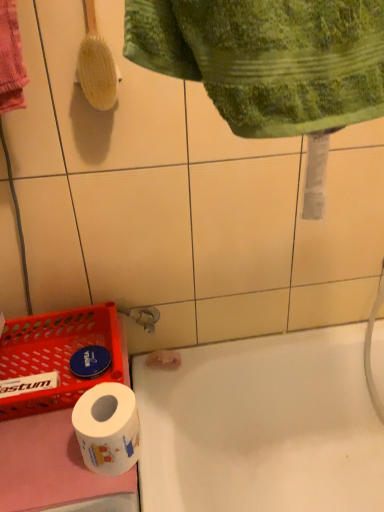
What do you see at coordinates (96, 65) in the screenshot? The width and height of the screenshot is (384, 512). I see `yellow wooden brush at upper left` at bounding box center [96, 65].

Identify the location of yellow wooden brush at upper left. Image resolution: width=384 pixels, height=512 pixels. (96, 65).

Does yellow wooden brush at upper left have a greater height compared to green textured towel at upper center?

Indeed, yellow wooden brush at upper left has a greater height compared to green textured towel at upper center.

Considering the positions of objects yellow wooden brush at upper left and green textured towel at upper center in the image provided, who is more to the right, yellow wooden brush at upper left or green textured towel at upper center?

From the viewer's perspective, green textured towel at upper center appears more on the right side.

Based on the photo, is yellow wooden brush at upper left positioned in front of green textured towel at upper center?

That is False.

Would you say yellow wooden brush at upper left is a long distance from green textured towel at upper center?

No, yellow wooden brush at upper left is in close proximity to green textured towel at upper center.

Considering the sizes of objects green textured towel at upper center and white glossy toilet paper at lower left in the image provided, who is smaller, green textured towel at upper center or white glossy toilet paper at lower left?

With smaller size is white glossy toilet paper at lower left.

Can you tell me how much green textured towel at upper center and white glossy toilet paper at lower left differ in facing direction?

The angle between the facing direction of green textured towel at upper center and the facing direction of white glossy toilet paper at lower left is 0.00291 degrees.

Is green textured towel at upper center closer to the viewer compared to white glossy toilet paper at lower left?

That is True.

Between point (279, 85) and point (84, 433), which one is positioned behind?

Point (84, 433)

Is yellow wooden brush at upper left completely or partially inside green textured towel at upper center?

No.

From a real-world perspective, is green textured towel at upper center physically below yellow wooden brush at upper left?

No, from a real-world perspective, green textured towel at upper center is not under yellow wooden brush at upper left.

Where is `brush that appears on the left of green textured towel at upper center`? The image size is (384, 512). brush that appears on the left of green textured towel at upper center is located at coordinates (x=96, y=65).

Looking at their sizes, would you say green textured towel at upper center is wider or thinner than yellow wooden brush at upper left?

Considering their sizes, green textured towel at upper center looks broader than yellow wooden brush at upper left.

From a real-world perspective, is white glossy bathtub at lower center physically below white glossy toilet paper at lower left?

Yes, from a real-world perspective, white glossy bathtub at lower center is beneath white glossy toilet paper at lower left.

Who is shorter, white glossy bathtub at lower center or white glossy toilet paper at lower left?

white glossy toilet paper at lower left is shorter.

Looking at this image, what's the angular difference between white glossy bathtub at lower center and white glossy toilet paper at lower left's facing directions?

They differ by 0.000882 degrees in their facing directions.

Is white glossy bathtub at lower center outside of white glossy toilet paper at lower left?

Yes, white glossy bathtub at lower center is located beyond the bounds of white glossy toilet paper at lower left.

From the image's perspective, who appears lower, white glossy bathtub at lower center or yellow wooden brush at upper left?

white glossy bathtub at lower center, from the image's perspective.

Who is more distant, white glossy bathtub at lower center or yellow wooden brush at upper left?

white glossy bathtub at lower center is further away from the camera.

Between white glossy bathtub at lower center and yellow wooden brush at upper left, which one appears on the left side from the viewer's perspective?

yellow wooden brush at upper left.

Measure the distance between white glossy toilet paper at lower left and green textured towel at upper center.

The distance of white glossy toilet paper at lower left from green textured towel at upper center is 19.99 inches.

From a real-world perspective, is white glossy toilet paper at lower left on top of green textured towel at upper center?

No.

Is white glossy toilet paper at lower left in contact with green textured towel at upper center?

No, white glossy toilet paper at lower left is not next to green textured towel at upper center.

Does white glossy toilet paper at lower left contain green textured towel at upper center?

Actually, green textured towel at upper center is outside white glossy toilet paper at lower left.

Is white glossy bathtub at lower center to the right of green textured towel at upper center from the viewer's perspective?

Correct, you'll find white glossy bathtub at lower center to the right of green textured towel at upper center.

You are a GUI agent. You are given a task and a screenshot of the screen. Output one action in this format:
    pyautogui.click(x=<x>, y=<y>)
    Task: Click on the bath on the right of green textured towel at upper center
    This screenshot has height=512, width=384.
    Given the screenshot: What is the action you would take?
    (x=262, y=426)

Considering the relative sizes of white glossy bathtub at lower center and green textured towel at upper center in the image provided, is white glossy bathtub at lower center bigger than green textured towel at upper center?

Yes.

Could you tell me if white glossy bathtub at lower center is turned towards green textured towel at upper center?

No.

Where is `towel that is below the yellow wooden brush at upper left (from the image's perspective)`? towel that is below the yellow wooden brush at upper left (from the image's perspective) is located at coordinates (268, 58).

What are the coordinates of `towel lying on the right of white glossy toilet paper at lower left` in the screenshot? It's located at (268, 58).

Based on their spatial positions, is green textured towel at upper center or white glossy bathtub at lower center further from yellow wooden brush at upper left?

Among the two, white glossy bathtub at lower center is located further to yellow wooden brush at upper left.

In the scene shown: Based on their spatial positions, is yellow wooden brush at upper left or white glossy toilet paper at lower left further from green textured towel at upper center?

white glossy toilet paper at lower left is positioned further to the anchor green textured towel at upper center.

Considering their positions, is white glossy toilet paper at lower left positioned further to green textured towel at upper center than yellow wooden brush at upper left?

white glossy toilet paper at lower left is further to green textured towel at upper center.

From the image, which object appears to be farther from white glossy toilet paper at lower left, yellow wooden brush at upper left or green textured towel at upper center?

Based on the image, yellow wooden brush at upper left appears to be further to white glossy toilet paper at lower left.

Based on the photo, from the image, which object appears to be nearer to white glossy toilet paper at lower left, green textured towel at upper center or yellow wooden brush at upper left?

Based on the image, green textured towel at upper center appears to be nearer to white glossy toilet paper at lower left.

Which object lies nearer to the anchor point white glossy toilet paper at lower left, green textured towel at upper center or white glossy bathtub at lower center?

Based on the image, white glossy bathtub at lower center appears to be nearer to white glossy toilet paper at lower left.

When comparing their distances from yellow wooden brush at upper left, does white glossy bathtub at lower center or green textured towel at upper center seem further?

Among the two, white glossy bathtub at lower center is located further to yellow wooden brush at upper left.

Based on their spatial positions, is white glossy bathtub at lower center or yellow wooden brush at upper left closer to white glossy toilet paper at lower left?

white glossy bathtub at lower center.

Where is `toilet paper between green textured towel at upper center and white glossy bathtub at lower center in the vertical direction`? toilet paper between green textured towel at upper center and white glossy bathtub at lower center in the vertical direction is located at coordinates (107, 428).

Identify the location of towel between yellow wooden brush at upper left and white glossy toilet paper at lower left from top to bottom. (268, 58).

Identify the location of towel between yellow wooden brush at upper left and white glossy bathtub at lower center in the vertical direction. (268, 58).

Locate an element on the screen. The height and width of the screenshot is (512, 384). toilet paper between yellow wooden brush at upper left and white glossy bathtub at lower center vertically is located at coordinates (x=107, y=428).